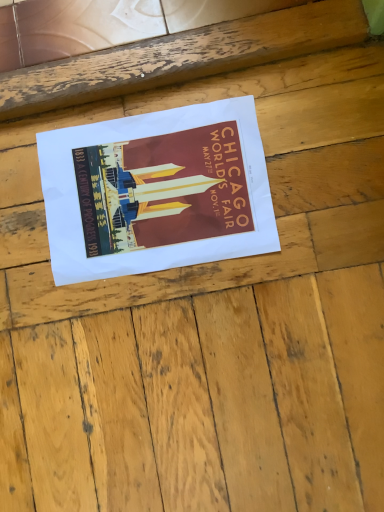
You are a GUI agent. You are given a task and a screenshot of the screen. Output one action in this format:
    pyautogui.click(x=<x>, y=<y>)
    Task: Click on the spots to the right of matte paper poster at center
    This screenshot has width=384, height=512.
    Given the screenshot: What is the action you would take?
    pyautogui.click(x=314, y=159)